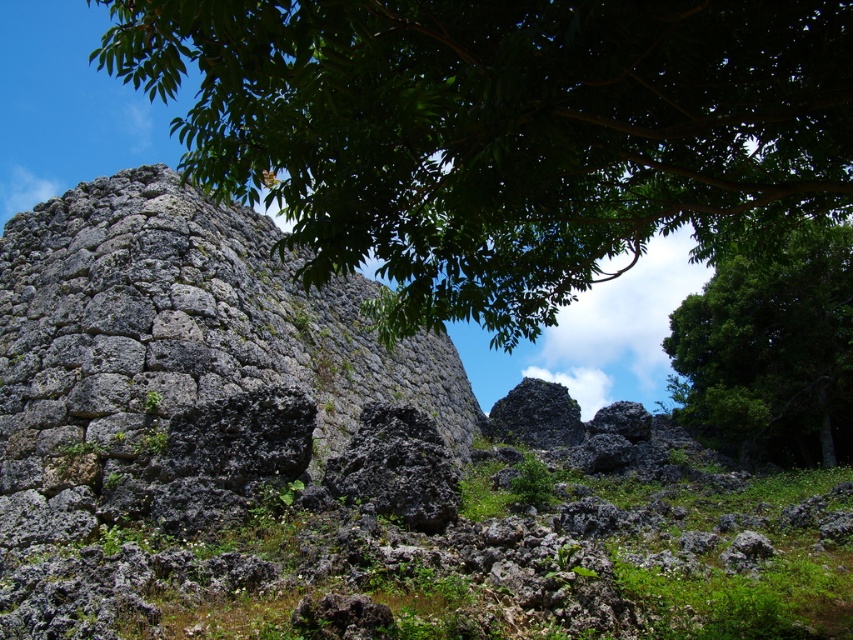
Question: Which of the following is the farthest from the observer?

Choices:
 (A) gray stone wall at center
 (B) green leafy tree at upper center
 (C) green leafy tree at upper right

Answer: (C)

Question: From the image, what is the correct spatial relationship of gray stone wall at center in relation to green leafy tree at upper center?

Choices:
 (A) left
 (B) right

Answer: (B)

Question: Where is gray stone wall at center located in relation to green leafy tree at upper right in the image?

Choices:
 (A) left
 (B) right

Answer: (A)

Question: Is gray stone wall at center to the left of green leafy tree at upper center from the viewer's perspective?

Choices:
 (A) yes
 (B) no

Answer: (B)

Question: Which point is farther from the camera taking this photo?

Choices:
 (A) (737, 93)
 (B) (844, 337)

Answer: (B)

Question: Estimate the real-world distances between objects in this image. Which object is farther from the green leafy tree at upper center?

Choices:
 (A) green leafy tree at upper right
 (B) gray stone wall at center

Answer: (A)